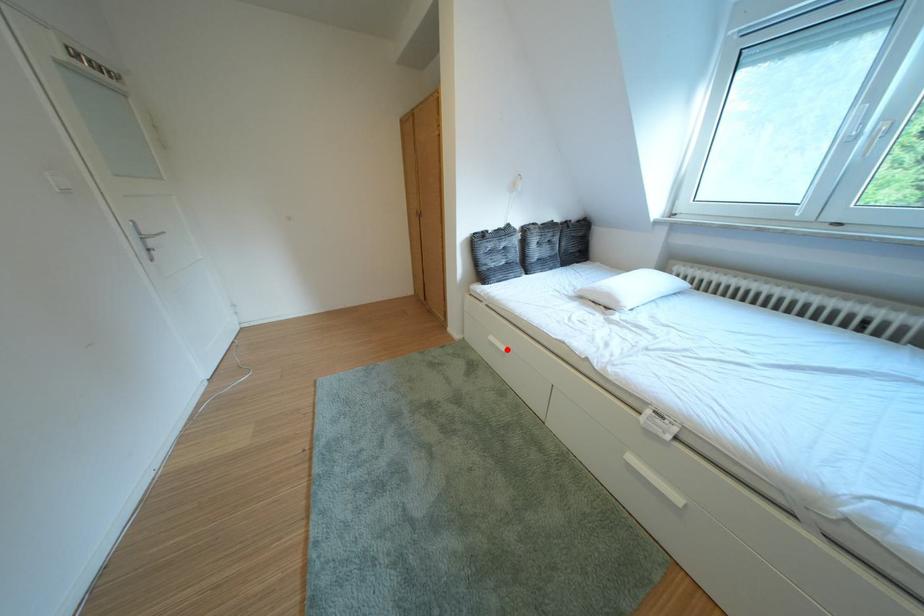
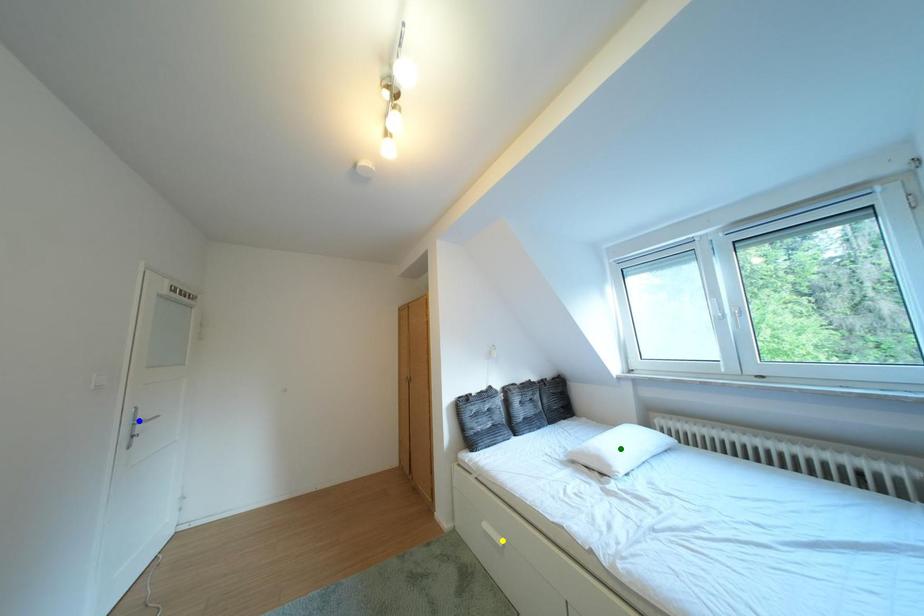
Question: I am providing you with two images of the same scene from different viewpoints. A red point is marked on the first image. You are given multiple points on the second image. Which point in image 2 is actually the same real-world point as the red point in image 1?

Choices:
 (A) green point
 (B) blue point
 (C) yellow point

Answer: (C)